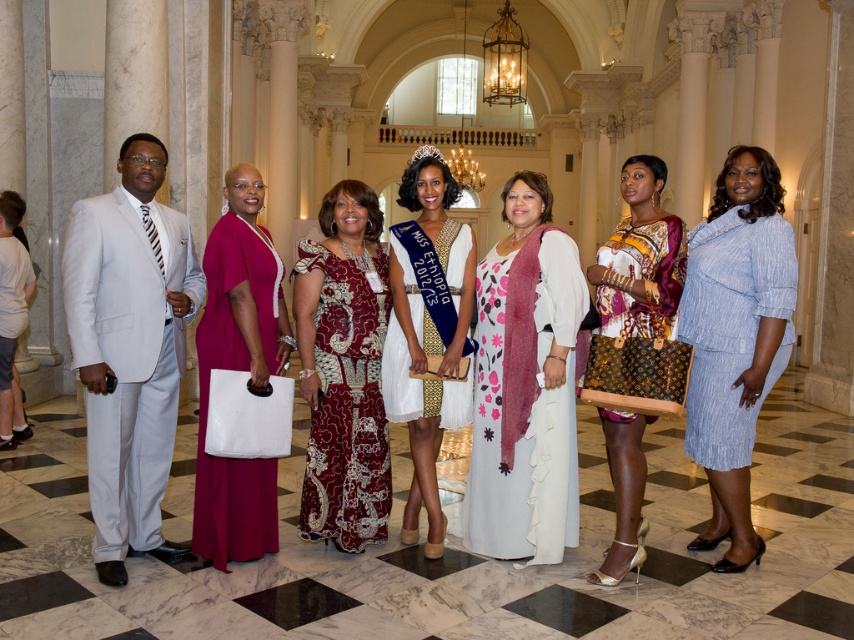
You are a photographer at the event and need to arrange the two dresses, maroon satin dress at center and matte pink dress at center, for a photo. Which dress should be placed in the foreground to make the composition look balanced?

The maroon satin dress at center is shorter than the matte pink dress at center, so placing the shorter maroon satin dress at center in the foreground would help balance the composition by offsetting the height difference.

Based on the scene description, where is the maroon satin dress at center located in terms of coordinates?

The maroon satin dress at center is located at coordinates (343,371).